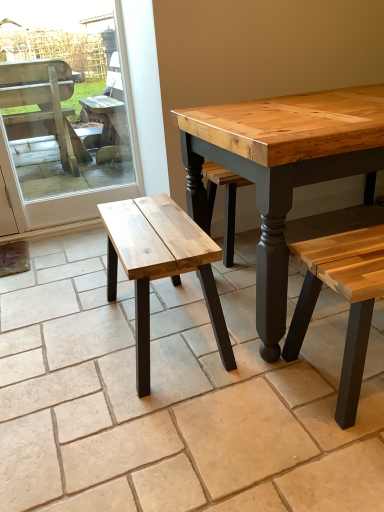
The width and height of the screenshot is (384, 512). I want to click on wooden bench at left, so click(75, 192).

What do you see at coordinates (75, 192) in the screenshot? I see `wooden bench at left` at bounding box center [75, 192].

Describe the element at coordinates (160, 266) in the screenshot. I see `natural wood bench at center` at that location.

Image resolution: width=384 pixels, height=512 pixels. In order to click on natural wood bench at center in this screenshot , I will do `click(160, 266)`.

Find the location of a particular element. Image resolution: width=384 pixels, height=512 pixels. wooden bench at left is located at coordinates (75, 192).

Which object is positioned more to the right, natural wood bench at center or wooden bench at left?

natural wood bench at center.

Considering the positions of objects natural wood bench at center and wooden bench at left in the image provided, who is behind, natural wood bench at center or wooden bench at left?

wooden bench at left is behind.

Is point (149, 385) closer to camera compared to point (72, 197)?

Yes, it is in front of point (72, 197).

Based on the photo, from the image's perspective, between natural wood bench at center and wooden bench at left, who is located below?

natural wood bench at center appears lower in the image.

From a real-world perspective, is natural wood bench at center positioned under wooden bench at left based on gravity?

Yes.

Can you confirm if natural wood bench at center is thinner than wooden bench at left?

No.

Based on the photo, can you confirm if natural wood bench at center is taller than wooden bench at left?

No, natural wood bench at center is not taller than wooden bench at left.

Is natural wood bench at center smaller than wooden bench at left?

Actually, natural wood bench at center might be larger than wooden bench at left.

Is natural wood bench at center located outside wooden bench at left?

Absolutely, natural wood bench at center is external to wooden bench at left.

Are natural wood bench at center and wooden bench at left making contact?

natural wood bench at center and wooden bench at left are not in contact.

Is natural wood bench at center looking in the opposite direction of wooden bench at left?

No.

How different are the orientations of natural wood bench at center and wooden bench at left in degrees?

90.5 degrees.

What are the coordinates of `stool located on the right of wooden bench at left` in the screenshot? It's located at coord(160,266).

Which object is positioned more to the right, wooden bench at left or natural wood bench at center?

From the viewer's perspective, natural wood bench at center appears more on the right side.

Which object is further away from the camera, wooden bench at left or natural wood bench at center?

Positioned behind is wooden bench at left.

Is point (58, 218) farther from viewer compared to point (171, 201)?

Yes.

From the image's perspective, between wooden bench at left and natural wood bench at center, who is located below?

natural wood bench at center, from the image's perspective.

From a real-world perspective, is wooden bench at left physically located above or below natural wood bench at center?

In terms of real-world spatial position, wooden bench at left is above natural wood bench at center.

Looking at their sizes, would you say wooden bench at left is wider or thinner than natural wood bench at center?

In the image, wooden bench at left appears to be more narrow than natural wood bench at center.

Considering the relative sizes of wooden bench at left and natural wood bench at center in the image provided, is wooden bench at left shorter than natural wood bench at center?

No.

Looking at the image, does wooden bench at left seem bigger or smaller compared to natural wood bench at center?

In the image, wooden bench at left appears to be smaller than natural wood bench at center.

Does wooden bench at left contain natural wood bench at center?

That's incorrect, natural wood bench at center is not inside wooden bench at left.

Does wooden bench at left touch natural wood bench at center?

No, wooden bench at left is not beside natural wood bench at center.

Is natural wood bench at center at the back of wooden bench at left?

wooden bench at left is not turned away from natural wood bench at center.

What's the angular difference between wooden bench at left and natural wood bench at center's facing directions?

There is a 90.5-degree angle between the facing directions of wooden bench at left and natural wood bench at center.

Locate an element on the screen. The width and height of the screenshot is (384, 512). stool in front of the wooden bench at left is located at coordinates (160, 266).

At what (x,y) coordinates should I click in order to perform the action: click on screen door above the natural wood bench at center (from the image's perspective). Please return your answer as a coordinate pair (x, y). Looking at the image, I should click on (75, 192).

Find the location of a particular element. This screenshot has width=384, height=512. screen door on the left of natural wood bench at center is located at coordinates (75, 192).